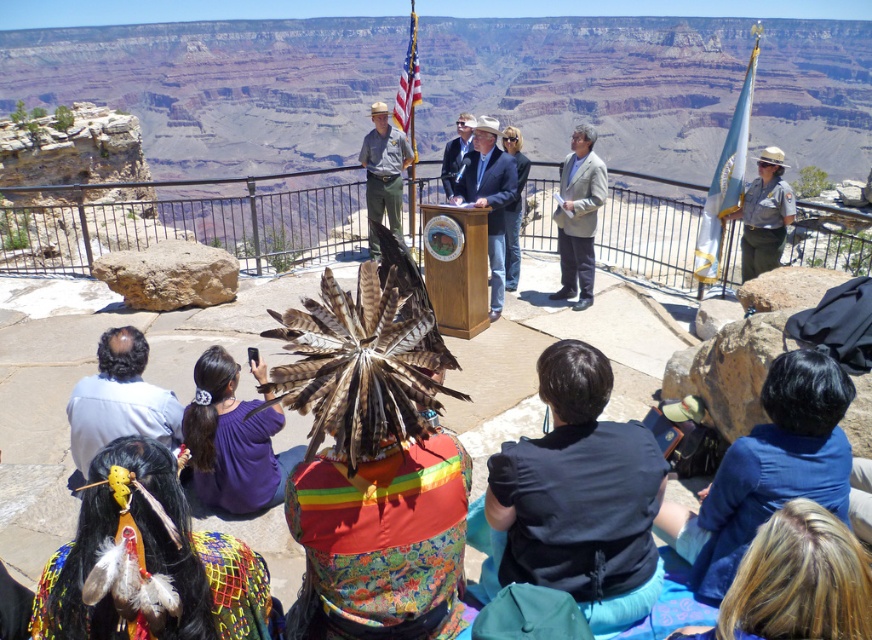
Question: Which point is farther to the camera?

Choices:
 (A) (567, 220)
 (B) (468, 136)

Answer: (B)

Question: Does blue fabric at lower right appear on the left side of light blue suit at center?

Choices:
 (A) no
 (B) yes

Answer: (A)

Question: Which object appears farthest from the camera in this image?

Choices:
 (A) khaki uniform at center
 (B) purple fabric at center
 (C) light blue suit at center
 (D) smooth wood podium at center

Answer: (C)

Question: Is khaki uniform at center smaller than american flag at center?

Choices:
 (A) yes
 (B) no

Answer: (A)

Question: Which of the following is the farthest from the observer?

Choices:
 (A) light gray suit at center
 (B) blue fabric at lower right
 (C) khaki uniform at center
 (D) dark blue shirt at lower left

Answer: (A)

Question: Is light gray suit at center bigger than white fabric flag at right?

Choices:
 (A) yes
 (B) no

Answer: (B)